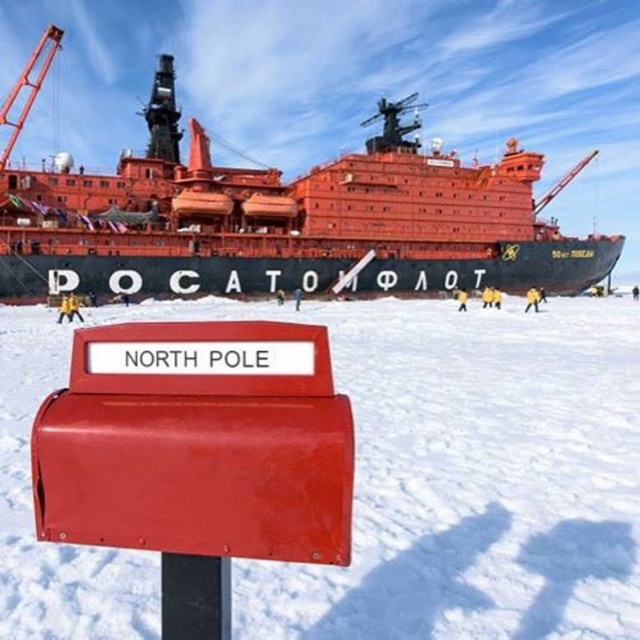
Does shiny orange ship at upper center have a smaller size compared to metallic red crane at upper left?

No.

This screenshot has width=640, height=640. What do you see at coordinates (288, 220) in the screenshot?
I see `shiny orange ship at upper center` at bounding box center [288, 220].

The width and height of the screenshot is (640, 640). I want to click on shiny orange ship at upper center, so click(x=288, y=220).

Can you confirm if white matte snow at center is positioned to the right of shiny orange ship at upper center?

No, white matte snow at center is not to the right of shiny orange ship at upper center.

Does white matte snow at center appear over shiny orange ship at upper center?

Actually, white matte snow at center is below shiny orange ship at upper center.

What do you see at coordinates (465, 472) in the screenshot? The width and height of the screenshot is (640, 640). I see `white matte snow at center` at bounding box center [465, 472].

The height and width of the screenshot is (640, 640). I want to click on white matte snow at center, so click(x=465, y=472).

The width and height of the screenshot is (640, 640). What do you see at coordinates (465, 472) in the screenshot?
I see `white matte snow at center` at bounding box center [465, 472].

Who is more forward, (561, 548) or (28, 112)?

Positioned in front is point (561, 548).

You are a GUI agent. You are given a task and a screenshot of the screen. Output one action in this format:
    pyautogui.click(x=<x>, y=<y>)
    Task: Click on the white matte snow at center
    This screenshot has height=640, width=640.
    Given the screenshot: What is the action you would take?
    pyautogui.click(x=465, y=472)